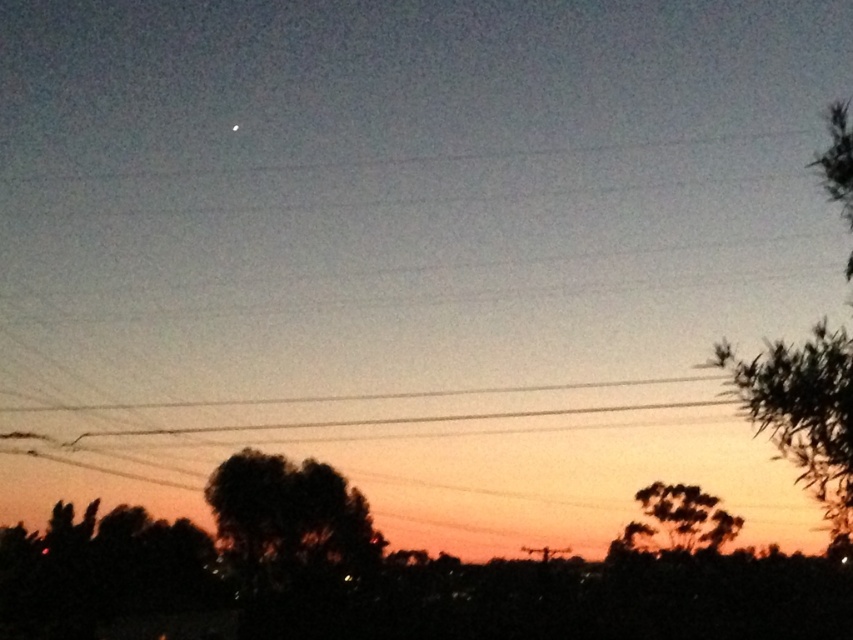
Question: Is dark green leafy tree at center above dark green leafy tree at lower right?

Choices:
 (A) yes
 (B) no

Answer: (A)

Question: Which point is closer to the camera?

Choices:
 (A) (630, 540)
 (B) (239, 541)

Answer: (B)

Question: Which point is closer to the camera?

Choices:
 (A) green leafy tree at right
 (B) dark green leafy tree at lower right

Answer: (A)

Question: Is green leafy tree at right to the right of dark green leafy tree at lower right from the viewer's perspective?

Choices:
 (A) no
 (B) yes

Answer: (B)

Question: Is dark green leafy tree at center to the left of dark green leafy tree at lower right from the viewer's perspective?

Choices:
 (A) no
 (B) yes

Answer: (B)

Question: Which object appears closest to the camera in this image?

Choices:
 (A) dark green leafy tree at center
 (B) dark green leafy tree at lower right
 (C) green leafy tree at right

Answer: (C)